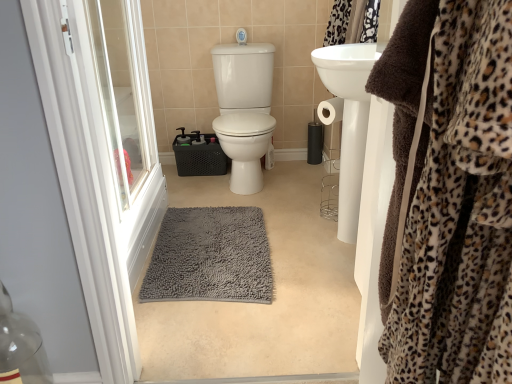
Find the location of a particular element. empty space that is ontop of gray shaggy rug at center is located at coordinates (262, 241).